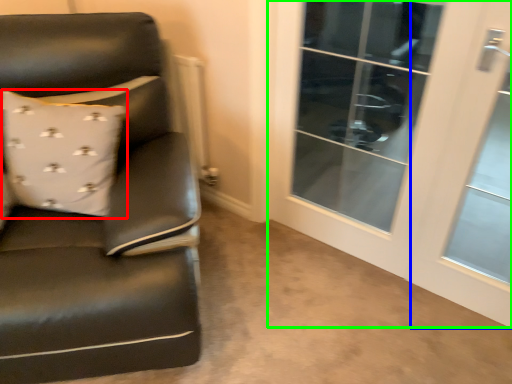
Question: Which object is positioned farthest from pillow (highlighted by a red box)? Select from screen door (highlighted by a blue box) and screen door (highlighted by a green box).

Choices:
 (A) screen door
 (B) screen door

Answer: (A)